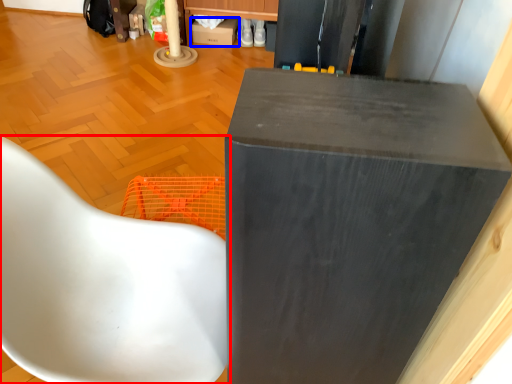
Question: Which object appears closest to the camera in this image, chair (highlighted by a red box) or cardboard box (highlighted by a blue box)?

Choices:
 (A) chair
 (B) cardboard box

Answer: (A)